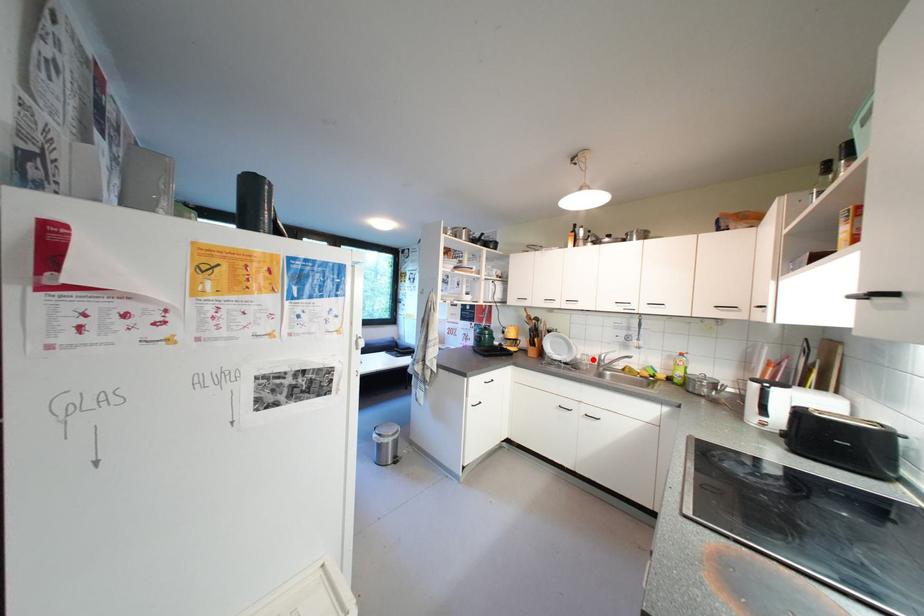
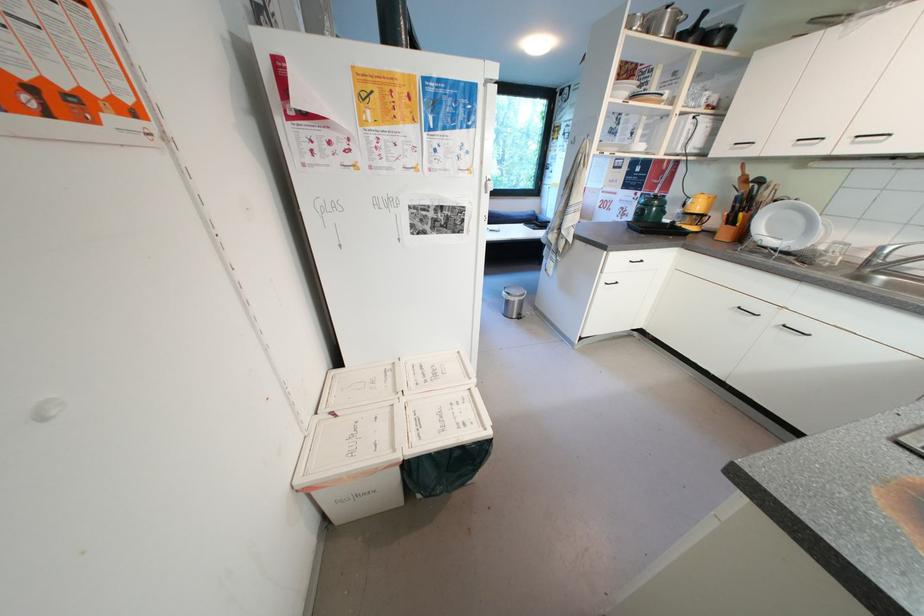
Where in the second image is the point corresponding to the highlighted location from the first image?

(845, 249)